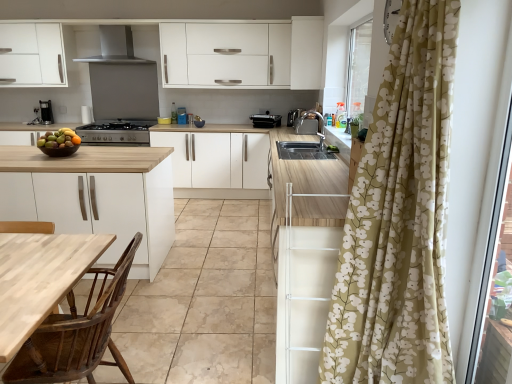
Question: In terms of height, does satin black stove at center look taller or shorter compared to black plastic toaster at center, which appears as the 1th appliance when viewed from the left?

Choices:
 (A) short
 (B) tall

Answer: (B)

Question: Is satin black stove at center wider or thinner than black plastic toaster at center, which is counted as the second appliance, starting from the right?

Choices:
 (A) thin
 (B) wide

Answer: (B)

Question: Estimate the real-world distances between objects in this image. Which object is closer to the satin silver toaster at upper center, which is the second appliance from left to right?

Choices:
 (A) white matte cabinet at center, the 1th cabinetry from the bottom
 (B) stainless steel exhaust hood at upper center
 (C) shiny brown bowl at left
 (D) satin black stove at center
 (E) white matte cabinet at upper center, which appears as the 1th cabinetry when viewed from the top

Answer: (E)

Question: Which is nearer to the wooden polished chair at lower left?

Choices:
 (A) satin silver toaster at upper center, the 1th appliance positioned from the right
 (B) black plastic toaster at center, which is counted as the second appliance, starting from the right
 (C) transparent glass screen door at right
 (D) white matte cabinet at upper center, which appears as the 1th cabinetry when viewed from the top
 (E) wooden at left

Answer: (E)